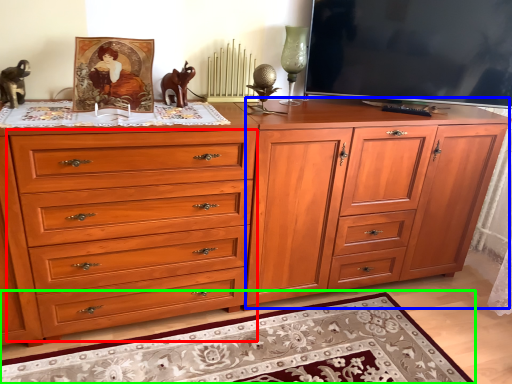
Question: Which object is positioned closest to drawer (highlighted by a red box)? Select from file cabinet (highlighted by a blue box) and mat (highlighted by a green box).

Choices:
 (A) file cabinet
 (B) mat

Answer: (B)